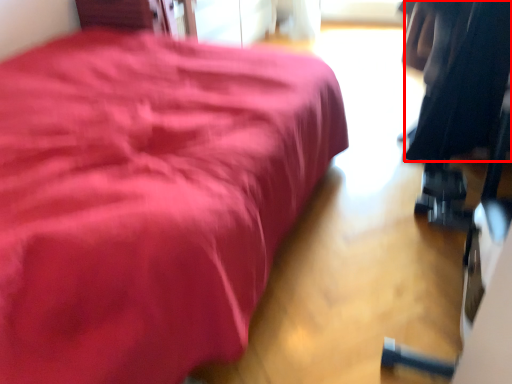
Question: From the image's perspective, what is the correct spatial positioning of clothing (annotated by the red box) in reference to furniture?

Choices:
 (A) above
 (B) below

Answer: (B)